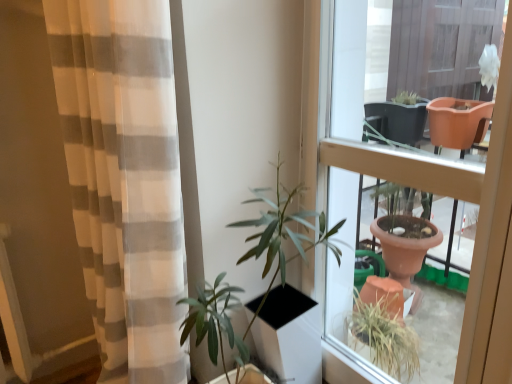
Question: Could you tell me if matte brown pot at center is facing white sheer curtain at left?

Choices:
 (A) no
 (B) yes

Answer: (B)

Question: Is matte brown pot at center taller than white sheer curtain at left?

Choices:
 (A) no
 (B) yes

Answer: (A)

Question: Is matte brown pot at center bigger than white sheer curtain at left?

Choices:
 (A) no
 (B) yes

Answer: (A)

Question: Is the depth of matte brown pot at center greater than that of white sheer curtain at left?

Choices:
 (A) no
 (B) yes

Answer: (B)

Question: Is matte brown pot at center wider than white sheer curtain at left?

Choices:
 (A) yes
 (B) no

Answer: (B)

Question: Is matte brown pot at center facing away from white sheer curtain at left?

Choices:
 (A) yes
 (B) no

Answer: (B)

Question: Is white sheer curtain at left further to camera compared to matte brown pot at center?

Choices:
 (A) no
 (B) yes

Answer: (A)

Question: Considering the relative sizes of white sheer curtain at left and matte brown pot at center in the image provided, is white sheer curtain at left smaller than matte brown pot at center?

Choices:
 (A) no
 (B) yes

Answer: (A)

Question: Is white sheer curtain at left touching matte brown pot at center?

Choices:
 (A) yes
 (B) no

Answer: (B)

Question: Could you tell me if white sheer curtain at left is facing matte brown pot at center?

Choices:
 (A) yes
 (B) no

Answer: (B)

Question: Is white sheer curtain at left not close to matte brown pot at center?

Choices:
 (A) yes
 (B) no

Answer: (B)

Question: Can you confirm if white sheer curtain at left is positioned to the right of matte brown pot at center?

Choices:
 (A) no
 (B) yes

Answer: (A)

Question: Considering the positions of matte brown pot at center and white sheer curtain at left in the image, is matte brown pot at center taller or shorter than white sheer curtain at left?

Choices:
 (A) short
 (B) tall

Answer: (A)